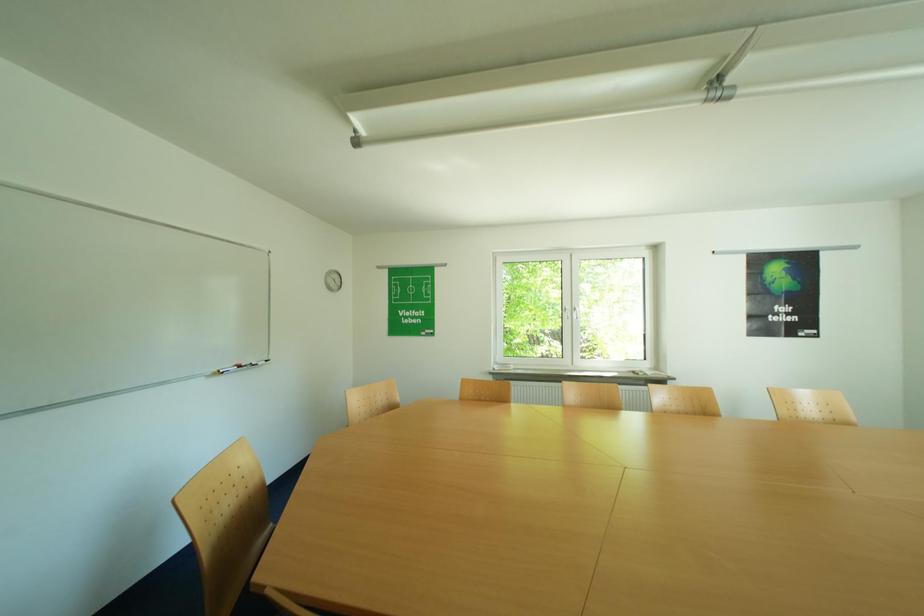
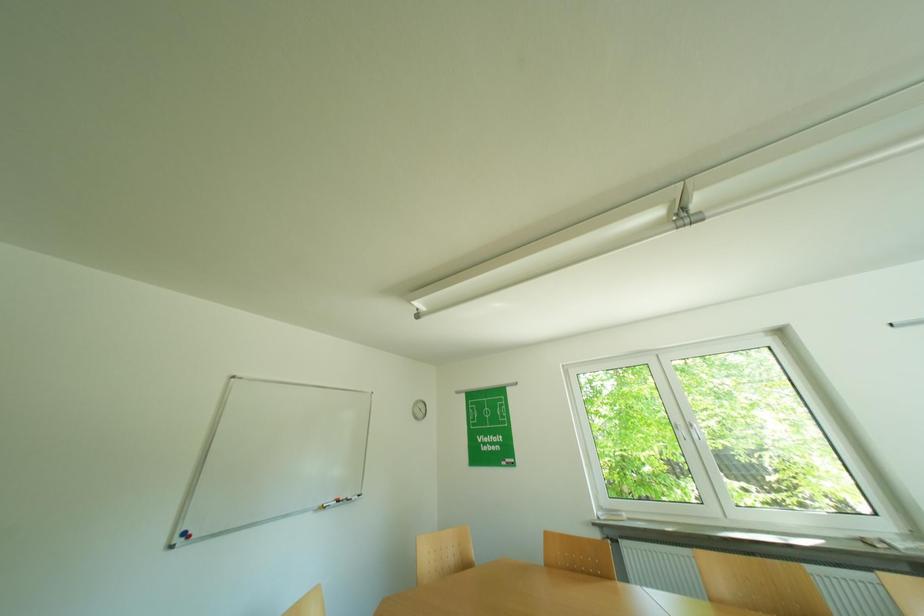
First-person continuous shooting, in which direction is the camera rotating?

The rotation direction of the camera is left-up.